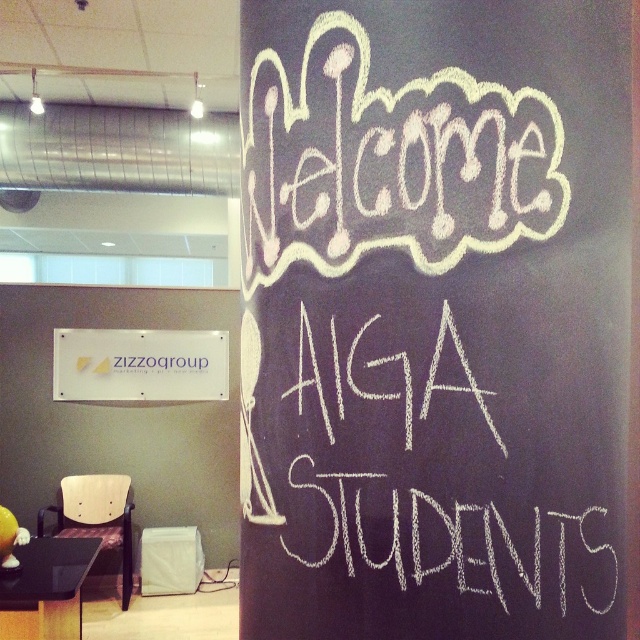
Can you confirm if white chalkboard at upper center is positioned above white plastic sign at upper left?

Yes.

Image resolution: width=640 pixels, height=640 pixels. Describe the element at coordinates (435, 317) in the screenshot. I see `white chalkboard at upper center` at that location.

I want to click on white chalkboard at upper center, so click(435, 317).

Is white chalkboard at upper center bigger than white chalk writing at center?

Yes.

Which is more to the left, white chalkboard at upper center or white chalk writing at center?

white chalkboard at upper center is more to the left.

Where is `white chalkboard at upper center`? The width and height of the screenshot is (640, 640). white chalkboard at upper center is located at coordinates (435, 317).

Between white chalk writing at center and white plastic sign at upper left, which one is positioned higher?

white plastic sign at upper left is above.

In the scene shown: Who is positioned more to the left, white chalk writing at center or white plastic sign at upper left?

white plastic sign at upper left is more to the left.

Locate an element on the screen. This screenshot has height=640, width=640. white chalk writing at center is located at coordinates (426, 477).

At what (x,y) coordinates should I click in order to perform the action: click on white chalk writing at center. Please return your answer as a coordinate pair (x, y). Image resolution: width=640 pixels, height=640 pixels. Looking at the image, I should click on (426, 477).